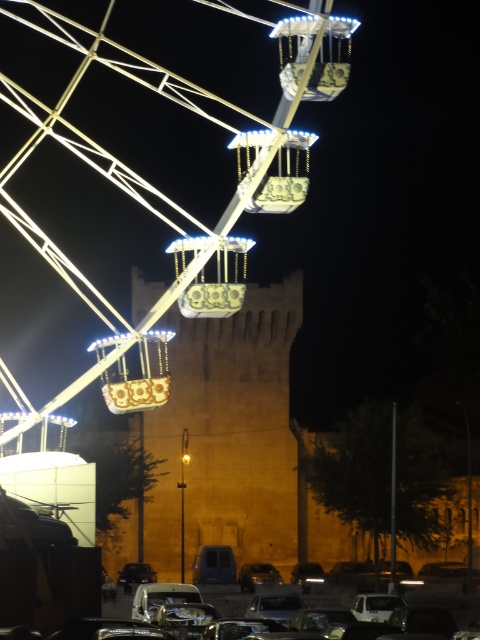
Question: Which object appears closest to the camera in this image?

Choices:
 (A) illuminated metal ferris wheel at center
 (B) shiny black car at lower center
 (C) shiny silver car at center

Answer: (A)

Question: Which object appears farthest from the camera in this image?

Choices:
 (A) shiny black car at lower center
 (B) illuminated metal ferris wheel at center
 (C) shiny silver car at lower center
 (D) shiny silver car at center

Answer: (D)

Question: Does yellow stone tower at center have a lesser width compared to shiny silver car at center?

Choices:
 (A) yes
 (B) no

Answer: (B)

Question: Can you confirm if yellow stone tower at center is positioned above shiny black car at lower center?

Choices:
 (A) yes
 (B) no

Answer: (A)

Question: Among these objects, which one is farthest from the camera?

Choices:
 (A) shiny silver car at lower center
 (B) shiny silver car at center
 (C) illuminated metal ferris wheel at center
 (D) shiny black car at lower center

Answer: (B)

Question: Is shiny silver car at lower center to the right of shiny black car at lower center from the viewer's perspective?

Choices:
 (A) no
 (B) yes

Answer: (B)